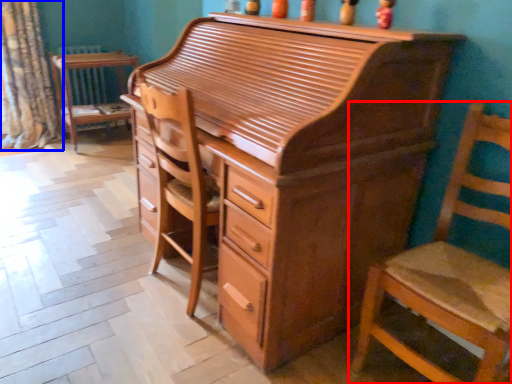
Question: Among these objects, which one is nearest to the camera, chair (highlighted by a red box) or curtain (highlighted by a blue box)?

Choices:
 (A) chair
 (B) curtain

Answer: (A)